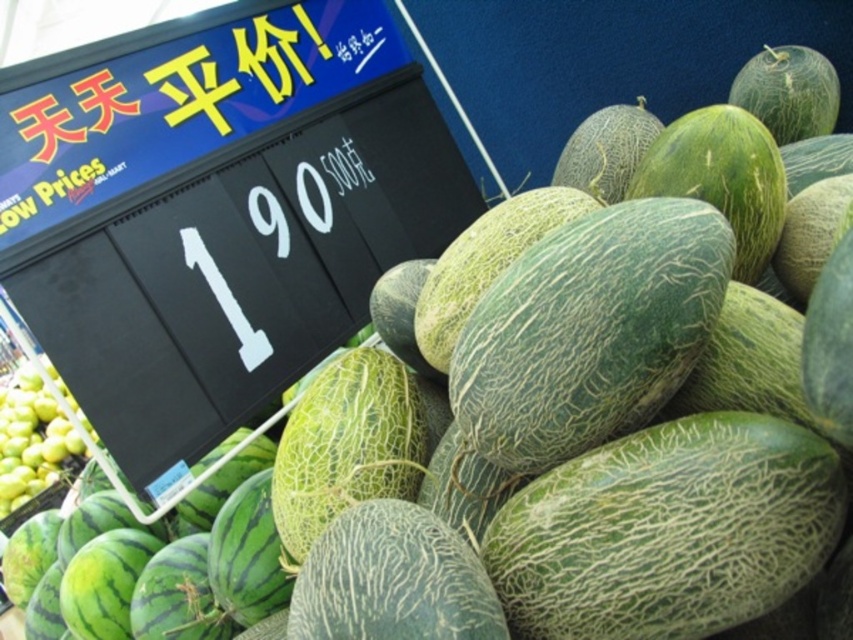
Describe the element at coordinates (589, 330) in the screenshot. I see `green textured melon at center` at that location.

Between point (459, 381) and point (53, 435), which one is positioned in front?

Point (459, 381) is more forward.

Locate an element on the screen. The height and width of the screenshot is (640, 853). green textured melon at center is located at coordinates (589, 330).

Locate an element on the screen. The image size is (853, 640). green textured melon at center is located at coordinates (589, 330).

Can you confirm if black plastic signboard at upper left is positioned above green textured melon at center?

Indeed, black plastic signboard at upper left is positioned over green textured melon at center.

How far apart are black plastic signboard at upper left and green textured melon at center?

A distance of 35.09 inches exists between black plastic signboard at upper left and green textured melon at center.

Is point (361, 93) positioned before point (608, 400)?

No.

Locate an element on the screen. The height and width of the screenshot is (640, 853). black plastic signboard at upper left is located at coordinates (241, 269).

The width and height of the screenshot is (853, 640). Find the location of `black plastic signboard at upper left`. black plastic signboard at upper left is located at coordinates (241, 269).

Can you confirm if black plastic signboard at upper left is thinner than green matte apples at lower left?

No, black plastic signboard at upper left is not thinner than green matte apples at lower left.

Between point (157, 364) and point (28, 444), which one is positioned behind?

Positioned behind is point (28, 444).

What are the coordinates of `black plastic signboard at upper left` in the screenshot? It's located at (241, 269).